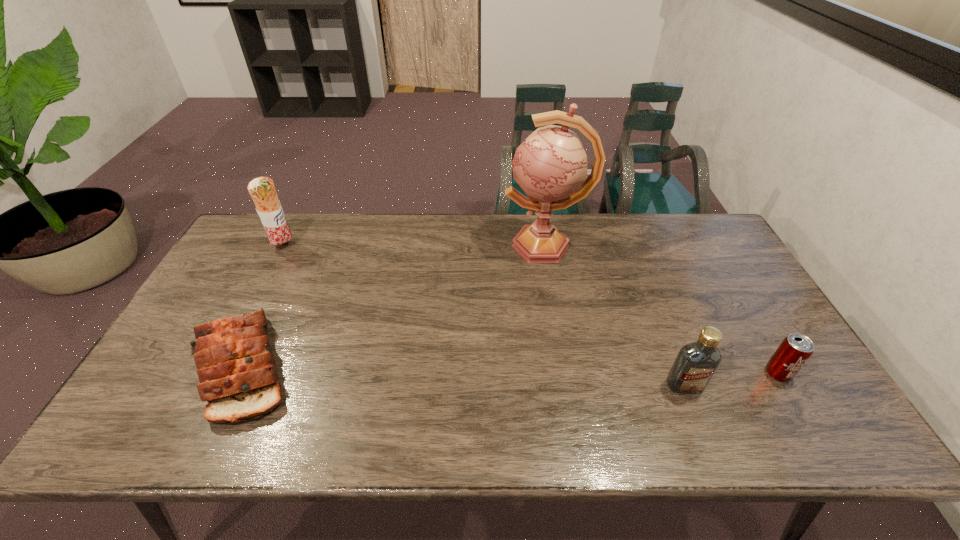
Find the location of `the tallest object`. the tallest object is located at coordinates (550, 166).

This screenshot has width=960, height=540. I want to click on globe, so click(550, 166).

Find the location of `burrito`. burrito is located at coordinates (262, 190).

Locate an element on the screen. This screenshot has height=540, width=960. the third tallest object is located at coordinates (695, 364).

This screenshot has height=540, width=960. Find the location of `vodka`. vodka is located at coordinates (695, 364).

At what (x,y) coordinates should I click in order to perform the action: click on beer can. Please return your answer as a coordinate pair (x, y). Looking at the image, I should click on (794, 351).

This screenshot has height=540, width=960. I want to click on bread, so click(x=236, y=367).

Where is `vacant space located 0.330m on the front-facing side of the third object from right to left`? The image size is (960, 540). vacant space located 0.330m on the front-facing side of the third object from right to left is located at coordinates (404, 246).

Image resolution: width=960 pixels, height=540 pixels. What are the coordinates of `vacant space located on the front-facing side of the third object from right to left` in the screenshot? It's located at tap(419, 246).

Where is `vacant area situated 0.400m on the front-facing side of the third object from right to left`? vacant area situated 0.400m on the front-facing side of the third object from right to left is located at coordinates (383, 246).